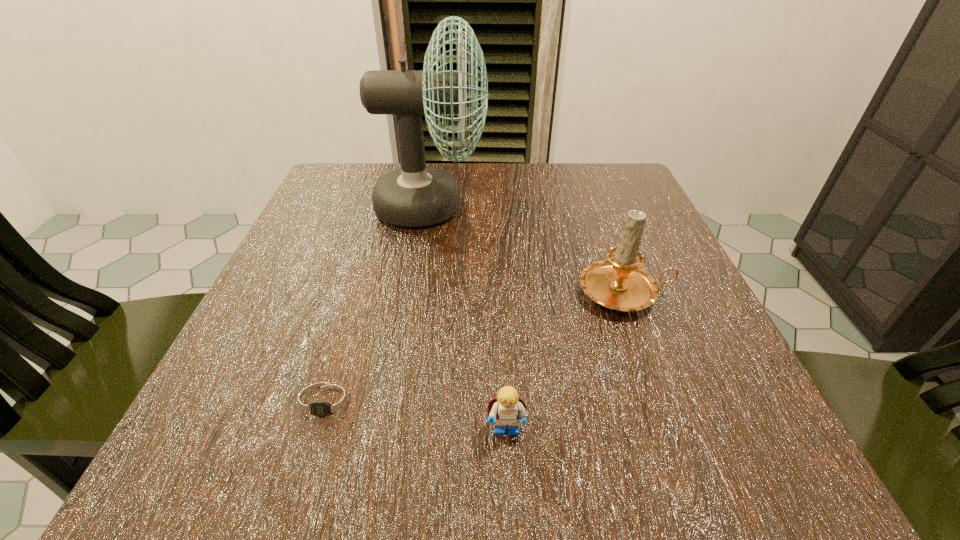
This screenshot has width=960, height=540. In order to click on vacant space that is in between the second shortest object and the second farthest object in this screenshot , I will do `click(565, 362)`.

I want to click on free point between the second farthest object and the fan, so click(528, 249).

You are a GUI agent. You are given a task and a screenshot of the screen. Output one action in this format:
    pyautogui.click(x=<x>, y=<y>)
    Task: Click on the empty space between the second farthest object and the Lego
    Image resolution: width=960 pixels, height=540 pixels.
    Given the screenshot: What is the action you would take?
    pyautogui.click(x=565, y=362)

In order to click on vacant region between the second farthest object and the farthest object in this screenshot , I will do 528,249.

At what (x,y) coordinates should I click in order to perform the action: click on vacant space in between the tallest object and the shortest object. Please return your answer as a coordinate pair (x, y). Image resolution: width=960 pixels, height=540 pixels. Looking at the image, I should click on tap(379, 304).

Where is `the second closest object relative to the tallest object`? The height and width of the screenshot is (540, 960). the second closest object relative to the tallest object is located at coordinates (326, 404).

Select which object is the closest to the shortest object. Please provide its 2D coordinates. Your answer should be formatted as a tuple, i.e. [(x, y)], where the tuple contains the x and y coordinates of a point satisfying the conditions above.

[(505, 409)]

This screenshot has height=540, width=960. In order to click on vacant space that satisfies the following two spatial constraints: 1. in front of the fan where the airflow is directed; 2. on the back side of the third shortest object in this screenshot , I will do `click(418, 293)`.

What are the coordinates of `vacant region that satisfies the following two spatial constraints: 1. in front of the tallest object where the airflow is directed; 2. on the face of the shortest object` in the screenshot? It's located at (400, 402).